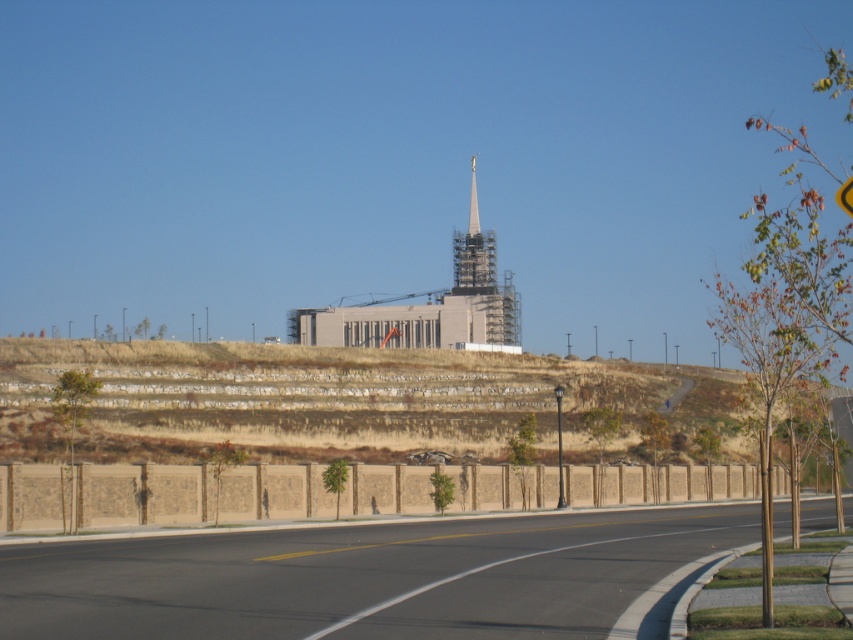
Question: Is brown textured hillside at center below yellow plastic triangle at upper center?

Choices:
 (A) no
 (B) yes

Answer: (B)

Question: Does asphalt road at center have a larger size compared to yellow plastic triangle at upper center?

Choices:
 (A) no
 (B) yes

Answer: (A)

Question: Which point appears farthest from the camera in this image?

Choices:
 (A) (843, 209)
 (B) (474, 193)

Answer: (B)

Question: Which object is positioned farthest from the asphalt road at center?

Choices:
 (A) yellow plastic triangle at upper center
 (B) brown textured hillside at center
 (C) white metallic spire at center

Answer: (C)

Question: Can you confirm if asphalt road at center is positioned to the right of yellow plastic triangle at upper center?

Choices:
 (A) no
 (B) yes

Answer: (A)

Question: Which is farther from the brown textured hillside at center?

Choices:
 (A) white metallic spire at center
 (B) yellow plastic triangle at upper center

Answer: (B)